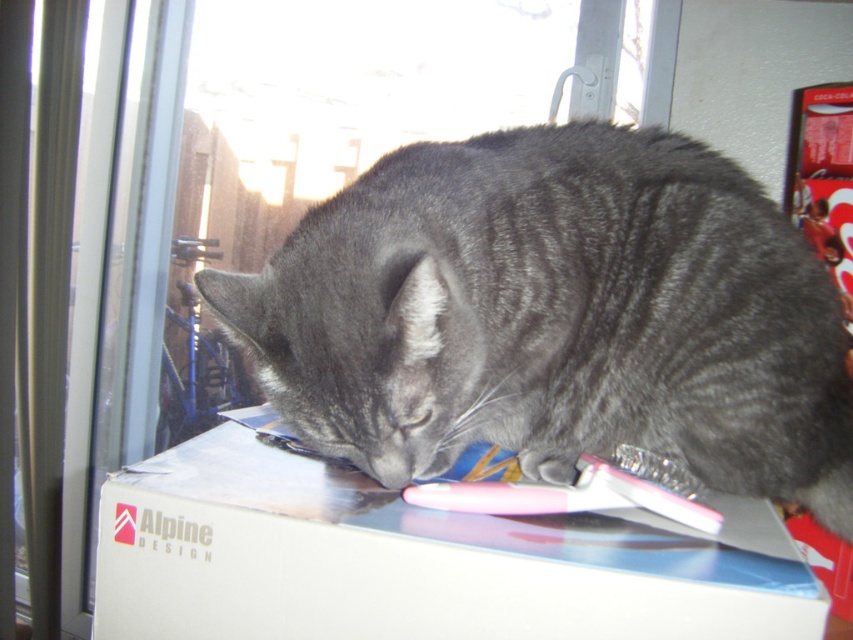
You are a photographer trying to capture a closeup of the gray fur cat at center and the gray fur paw at lower center. Since you want to focus on both, which one should you zoom in on more to ensure both are in focus?

The gray fur cat at center is bigger than the gray fur paw at lower center, so you should zoom in more on the gray fur cat at center to ensure both are in focus.

You are standing at the window frame and looking towards the residential area outside. There are two points marked on the window glass at coordinates point (842, 396) and point (374, 598). Which point is closer to you?

Point (374, 598) is closer to you because it is in front of point (842, 396).

You are a delivery person who just arrived at the house. You need to place a new package on the same spot as the white cardboard box at center. What are the coordinates you should target?

The white cardboard box at center is located at coordinates point (418, 561), so you should target those coordinates to place the new package.